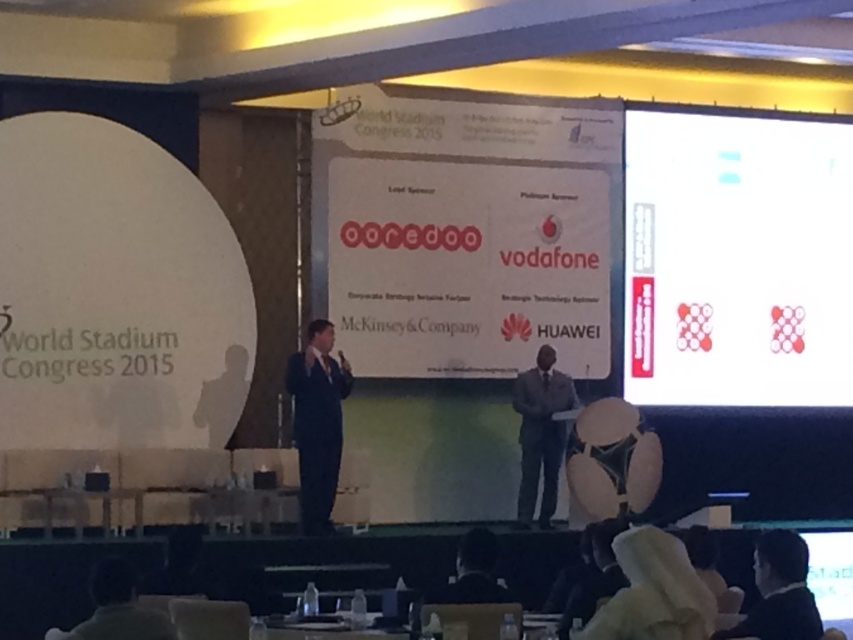
Question: Is the position of white paper at upper right more distant than that of black suit at lower right?

Choices:
 (A) no
 (B) yes

Answer: (B)

Question: Observing the image, what is the correct spatial positioning of black suit at center in reference to dark gray suit at center?

Choices:
 (A) above
 (B) below

Answer: (A)

Question: Which of the following is the closest to the observer?

Choices:
 (A) dark gray suit at center
 (B) white paper at upper right

Answer: (A)

Question: Is white paper at upper right closer to camera compared to black suit at center?

Choices:
 (A) no
 (B) yes

Answer: (A)

Question: Among these points, which one is farthest from the camera?

Choices:
 (A) click(300, 497)
 (B) click(682, 307)

Answer: (B)

Question: Which object is closer to the camera taking this photo?

Choices:
 (A) white paper at upper right
 (B) black suit at center
 (C) black suit at lower right
 (D) dark gray suit at center

Answer: (C)